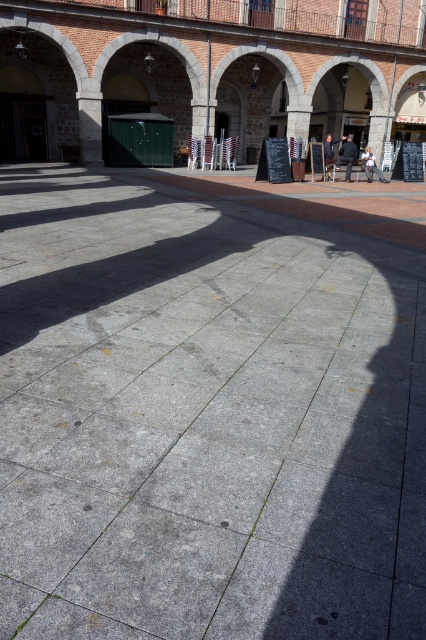
Question: Which point is closer to the camera?

Choices:
 (A) (330, 132)
 (B) (368, 177)
 (C) (339, 157)

Answer: (B)

Question: Observing the image, what is the correct spatial positioning of gray concrete pavement at center in reference to light blue denim jeans at center?

Choices:
 (A) right
 (B) left

Answer: (B)

Question: Can you confirm if gray concrete pavement at center is positioned to the right of dark blue jacket at center?

Choices:
 (A) no
 (B) yes

Answer: (A)

Question: Which point is closer to the camera?

Choices:
 (A) (351, 168)
 (B) (371, 154)
 (C) (11, 628)
 (D) (327, 148)

Answer: (C)

Question: Is dark blue jacket at center to the left of dark blue suit at center from the viewer's perspective?

Choices:
 (A) no
 (B) yes

Answer: (A)

Question: Which point is closer to the camera taking this photo?

Choices:
 (A) (339, 154)
 (B) (371, 168)

Answer: (A)